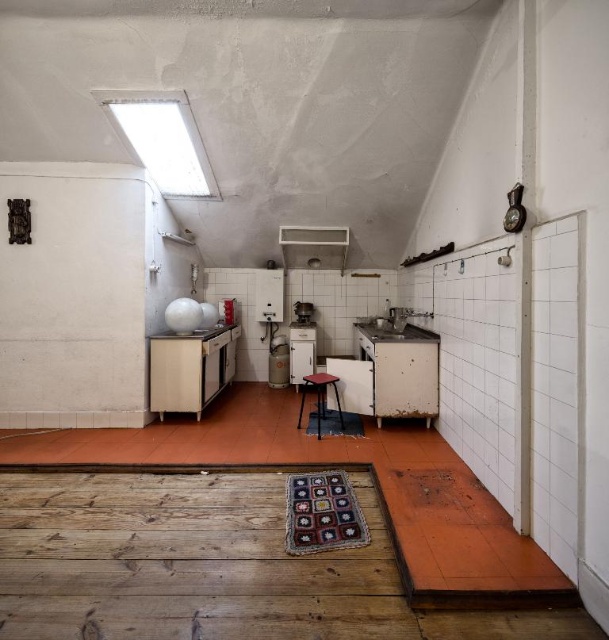
How distant is white glossy exhaust hood at upper center from white glossy refrigerator at center?

white glossy exhaust hood at upper center and white glossy refrigerator at center are 37.79 inches apart.

Can you confirm if white glossy exhaust hood at upper center is wider than white glossy refrigerator at center?

Yes.

The width and height of the screenshot is (609, 640). In order to click on white glossy exhaust hood at upper center in this screenshot , I will do `click(314, 244)`.

Can you confirm if wooden stool at center is positioned above metallic gray stove at center?

No, wooden stool at center is not above metallic gray stove at center.

Which is above, wooden stool at center or metallic gray stove at center?

metallic gray stove at center

Identify the location of wooden stool at center. The height and width of the screenshot is (640, 609). (319, 397).

Image resolution: width=609 pixels, height=640 pixels. What are the coordinates of `knitted multicolored rug at center` in the screenshot? It's located at (322, 513).

This screenshot has width=609, height=640. What do you see at coordinates (322, 513) in the screenshot? I see `knitted multicolored rug at center` at bounding box center [322, 513].

Between point (294, 538) and point (325, 412), which one is positioned in front?

Point (294, 538)

Identify the location of knitted multicolored rug at center. (322, 513).